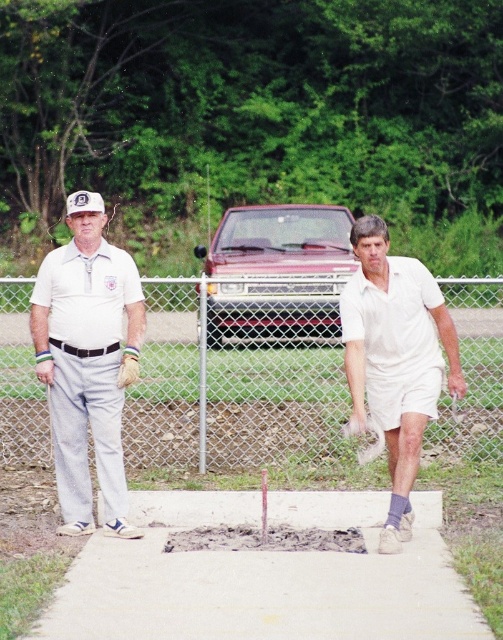
You are standing on the concrete platform and want to hand a croquet ball to the person wearing the white cotton shirt at left and the white cotton shirt at center. Which of the two people can you reach without moving from your current position?

The white cotton shirt at left can be reached without moving because the white cotton shirt at center is behind them, making them less accessible.

You are standing on the concrete platform and want to hand a croquet ball to both the white cotton shirt at left and the white cotton shirt at center. Given that you can only throw the ball 5 feet, can you reach both of them?

The white cotton shirt at left and white cotton shirt at center are 5.22 feet apart, so you cannot reach both with a 5 feet throw range.

You are a photographer standing in front of the concrete platform. You need to capture a photo that includes both the white cotton shirt at left and the white cotton shirt at center. Which shirt should you focus on to ensure both are in frame without moving your camera?

The white cotton shirt at left is much taller than the white cotton shirt at center, so focusing on the taller one might help include both in the frame.